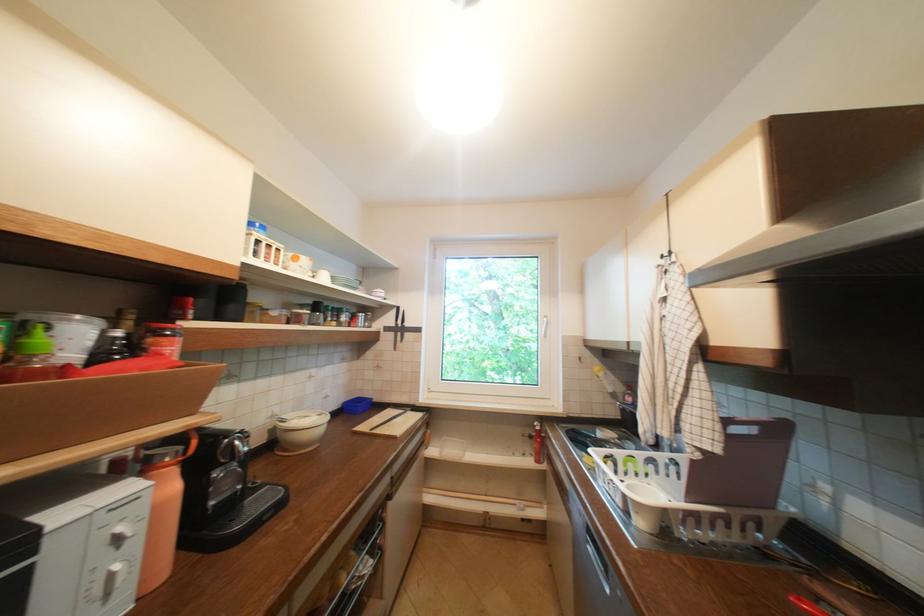
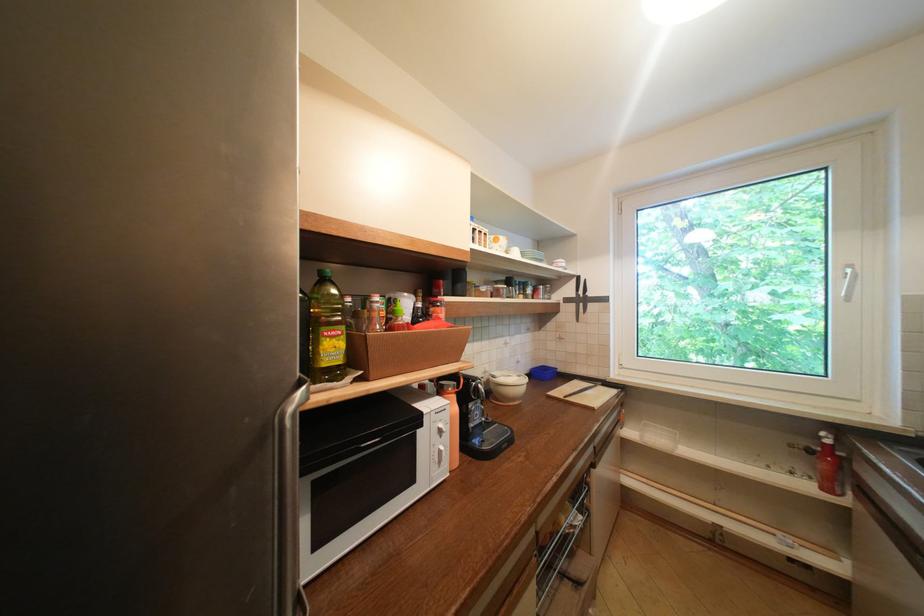
Locate, in the second image, the point that corresponds to [223,507] in the first image.

(481, 429)